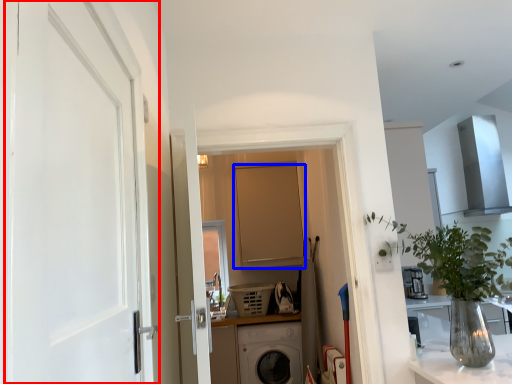
Question: Which of the following is the farthest to the observer, door (highlighted by a red box) or door (highlighted by a blue box)?

Choices:
 (A) door
 (B) door

Answer: (B)